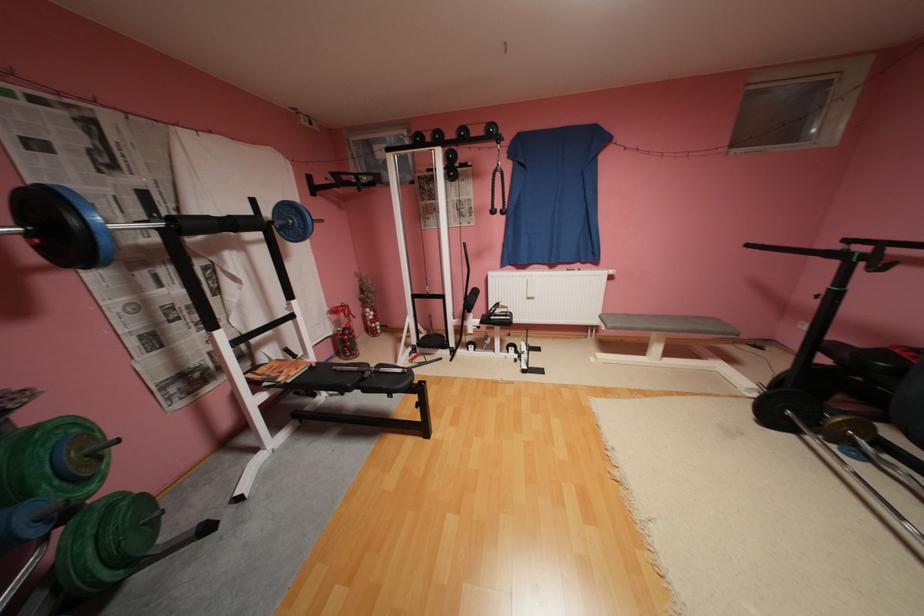
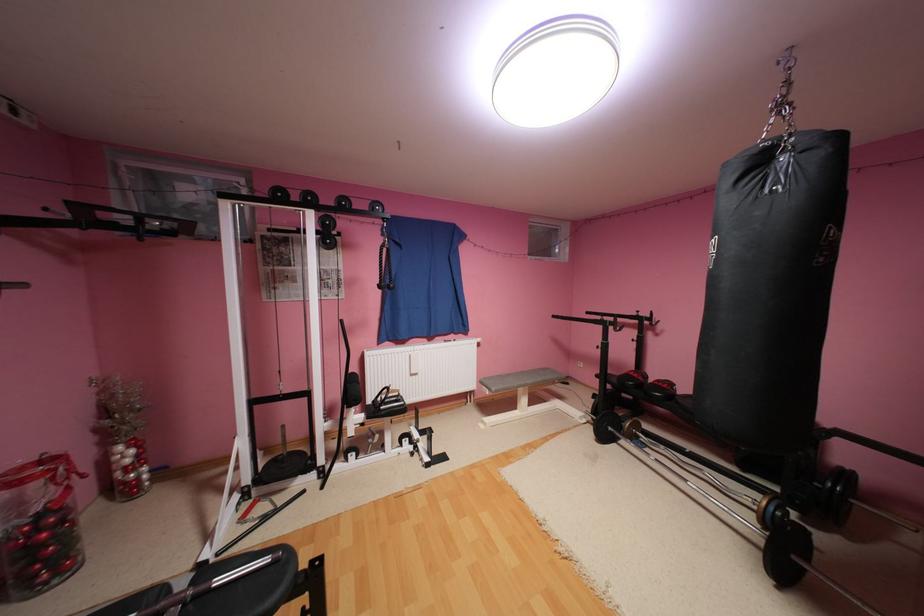
Question: The images are taken continuously from a first-person perspective. In which direction is your viewpoint rotating?

Choices:
 (A) Left
 (B) Right
 (C) Up
 (D) Down

Answer: (B)